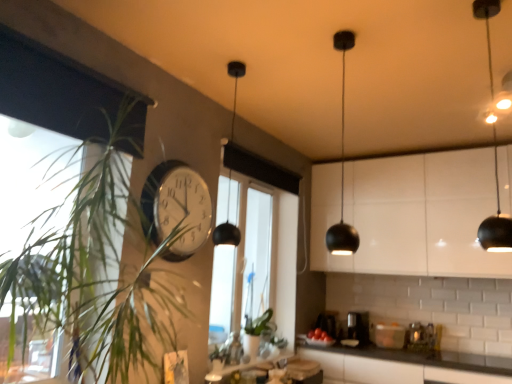
Describe the element at coordinates (177, 207) in the screenshot. The height and width of the screenshot is (384, 512). I see `white glossy clock at center` at that location.

The height and width of the screenshot is (384, 512). I want to click on red glossy tomatoes at lower center, so click(319, 335).

Identify the location of black matte pendant light at center. (227, 228).

What do you see at coordinates (106, 271) in the screenshot?
I see `green leafy plant at left` at bounding box center [106, 271].

At what (x,y) coordinates should I click in order to perform the action: click on black matte pendant light at upper right. Please return your answer as a coordinate pair (x, y). Looking at the image, I should click on (496, 221).

Based on the photo, what is the approximate width of transparent glass window at center?

transparent glass window at center is 3.93 inches in width.

The height and width of the screenshot is (384, 512). Identify the location of white glossy clock at center. (177, 207).

Is black matte pendant light at center completely or partially inside white glossy cabinet at upper right?

Actually, black matte pendant light at center is outside white glossy cabinet at upper right.

Is white glossy cabinet at upper right looking in the opposite direction of black matte pendant light at center?

white glossy cabinet at upper right does not have its back to black matte pendant light at center.

Does white glossy cabinet at upper right have a lesser height compared to black matte pendant light at center?

No, white glossy cabinet at upper right is not shorter than black matte pendant light at center.

Is the depth of white glossy cabinet at upper right less than that of black matte pendant light at center?

No.

Between black matte pendant light at upper center and black matte pendant light at upper right, which one has smaller size?

Smaller between the two is black matte pendant light at upper center.

Is black matte pendant light at upper center inside or outside of black matte pendant light at upper right?

black matte pendant light at upper center exists outside the volume of black matte pendant light at upper right.

Is black matte pendant light at upper center taller than black matte pendant light at upper right?

Yes.

Is black matte pendant light at upper right at the back of black matte pendant light at upper center?

No, black matte pendant light at upper center is not facing the opposite direction of black matte pendant light at upper right.

Between point (314, 334) and point (368, 325), which one is positioned behind?

The point (314, 334) is farther.

Which is in front, red glossy tomatoes at lower center or black plastic coffee machine at lower center?

red glossy tomatoes at lower center.

Can you tell me how much red glossy tomatoes at lower center and black plastic coffee machine at lower center differ in facing direction?

8.85 degrees separate the facing orientations of red glossy tomatoes at lower center and black plastic coffee machine at lower center.

In the scene shown: Are red glossy tomatoes at lower center and black plastic coffee machine at lower center located far from each other?

No.

Does transparent glass window at center come behind white glossy clock at center?

Yes, transparent glass window at center is further from the camera.

Is transparent glass window at center far from white glossy clock at center?

No.

From the image's perspective, is transparent glass window at center below white glossy clock at center?

Correct, transparent glass window at center appears lower than white glossy clock at center in the image.

How much distance is there between transparent glass window at center and white glossy clock at center?

They are 39.13 inches apart.

Is red glossy tomatoes at lower center next to black matte pendant light at upper center?

No, red glossy tomatoes at lower center is not with black matte pendant light at upper center.

In order to click on light above the red glossy tomatoes at lower center (from a real-world perspective) in this screenshot , I will do `click(342, 167)`.

From the image's perspective, between red glossy tomatoes at lower center and black matte pendant light at upper center, who is located below?

red glossy tomatoes at lower center is shown below in the image.

Considering the sizes of objects green leafy plant at left and black matte pendant light at center in the image provided, who is wider, green leafy plant at left or black matte pendant light at center?

Wider between the two is green leafy plant at left.

Locate an element on the screen. Image resolution: width=512 pixels, height=384 pixels. houseplant lying in front of the black matte pendant light at center is located at coordinates (106, 271).

Which object is further away from the camera, green leafy plant at left or black matte pendant light at center?

black matte pendant light at center.

From a real-world perspective, who is located higher, black matte pendant light at upper right or white glossy clock at center?

From a 3D spatial view, black matte pendant light at upper right is above.

Based on their positions, is black matte pendant light at upper right located to the left or right of white glossy clock at center?

Clearly, black matte pendant light at upper right is on the right of white glossy clock at center in the image.

Find the location of a particular element. Image resolution: width=512 pixels, height=384 pixels. light fixture above the white glossy clock at center (from the image's perspective) is located at coordinates (496, 221).

Can you confirm if black matte pendant light at upper right is bigger than white glossy clock at center?

Correct, black matte pendant light at upper right is larger in size than white glossy clock at center.

Identify the location of lamp above the white glossy cabinet at upper right (from the image's perspective). (227, 228).

The height and width of the screenshot is (384, 512). Find the location of `light fixture positioned vertically above the black matte pendant light at upper center (from a real-world perspective)`. light fixture positioned vertically above the black matte pendant light at upper center (from a real-world perspective) is located at coordinates (496, 221).

Considering their positions, is black matte pendant light at center positioned closer to black plastic coffee machine at lower center than green leafy plant at left?

black matte pendant light at center is positioned closer to the anchor black plastic coffee machine at lower center.

From the image, which object appears to be farther from green leafy plant at left, black plastic coffee machine at lower center or transparent glass window at center?

Based on the image, black plastic coffee machine at lower center appears to be further to green leafy plant at left.

Estimate the real-world distances between objects in this image. Which object is closer to transparent glass window at center, white glossy cabinet at upper right or black matte pendant light at upper center?

white glossy cabinet at upper right is closer to transparent glass window at center.

Considering their positions, is black matte pendant light at upper right positioned closer to white glossy cabinet at upper right than green leafy plant at left?

black matte pendant light at upper right lies closer to white glossy cabinet at upper right than the other object.

Considering their positions, is transparent glass window at center positioned further to black plastic coffee machine at lower center than black matte pendant light at upper right?

The object further to black plastic coffee machine at lower center is black matte pendant light at upper right.

Considering their positions, is black matte pendant light at center positioned further to black matte pendant light at upper right than black matte pendant light at upper center?

Among the two, black matte pendant light at center is located further to black matte pendant light at upper right.

When comparing their distances from red glossy tomatoes at lower center, does black matte pendant light at upper right or black plastic coffee machine at lower center seem closer?

black plastic coffee machine at lower center lies closer to red glossy tomatoes at lower center than the other object.

Which object lies further to the anchor point black matte pendant light at upper center, red glossy tomatoes at lower center or black plastic coffee machine at lower center?

The object further to black matte pendant light at upper center is red glossy tomatoes at lower center.

Locate an element on the screen. The width and height of the screenshot is (512, 384). cabinetry between green leafy plant at left and black plastic coffee machine at lower center along the z-axis is located at coordinates (410, 215).

Find the location of a particular element. The image size is (512, 384). clock between black matte pendant light at upper center and red glossy tomatoes at lower center in the front-back direction is located at coordinates (177, 207).

This screenshot has width=512, height=384. I want to click on light between black matte pendant light at upper right and transparent glass window at center along the z-axis, so click(x=342, y=167).

Where is `light between green leafy plant at left and transparent glass window at center from front to back`? light between green leafy plant at left and transparent glass window at center from front to back is located at coordinates (342, 167).